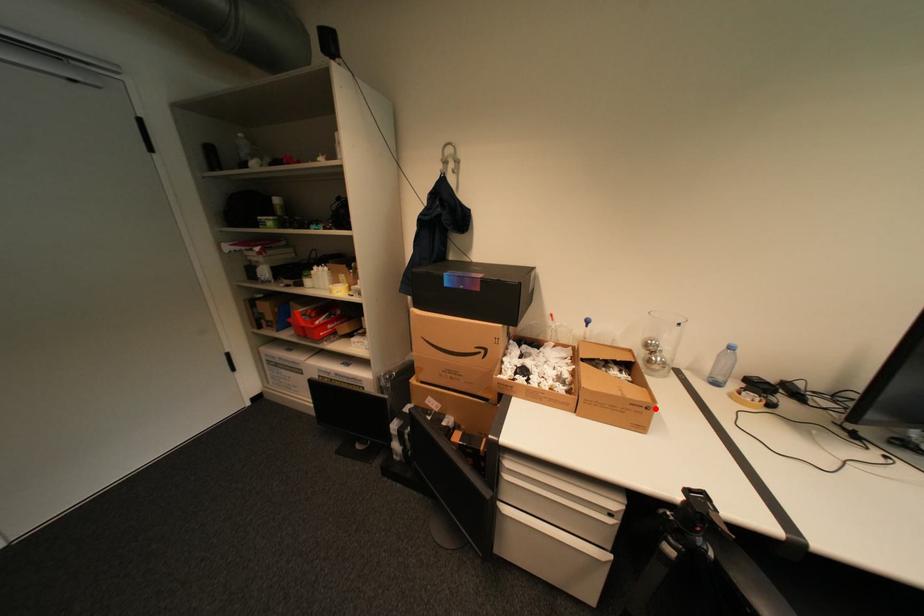
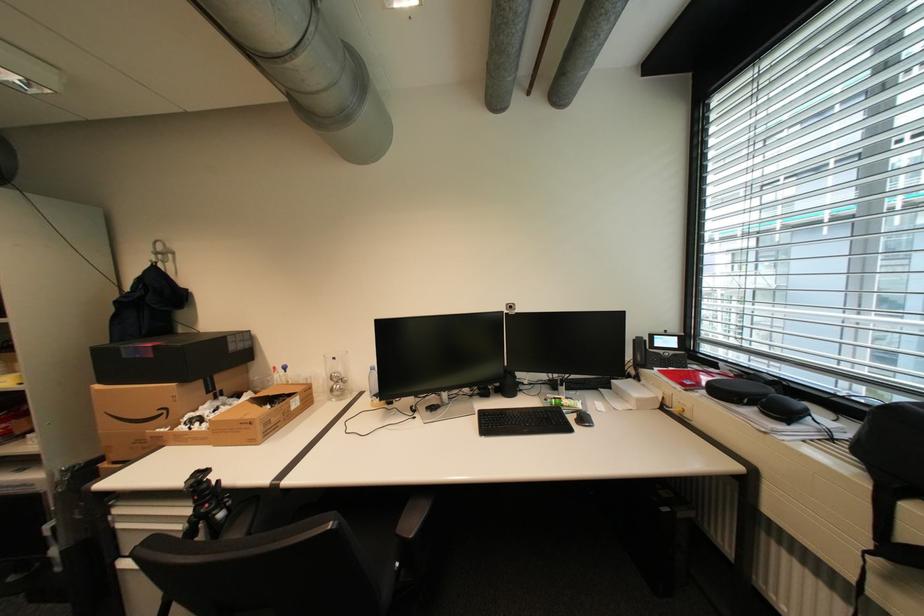
In the second image, find the point that corresponds to the highlighted location in the first image.

(259, 424)